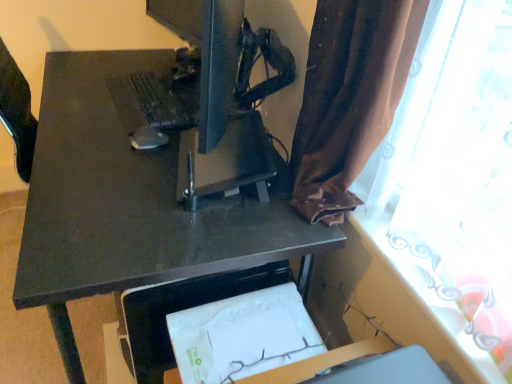
Identify the location of free space in front of matte black keyboard at upper left. (105, 135).